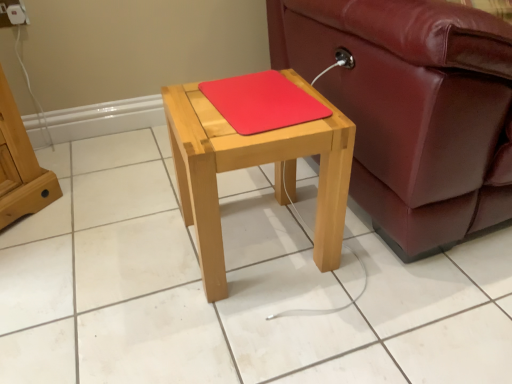
You are a GUI agent. You are given a task and a screenshot of the screen. Output one action in this format:
    pyautogui.click(x=<x>, y=<y>)
    Task: Click on the free point below natural wood table at center (from a real-world perspective)
    Image resolution: width=512 pixels, height=384 pixels.
    Given the screenshot: What is the action you would take?
    pyautogui.click(x=266, y=241)